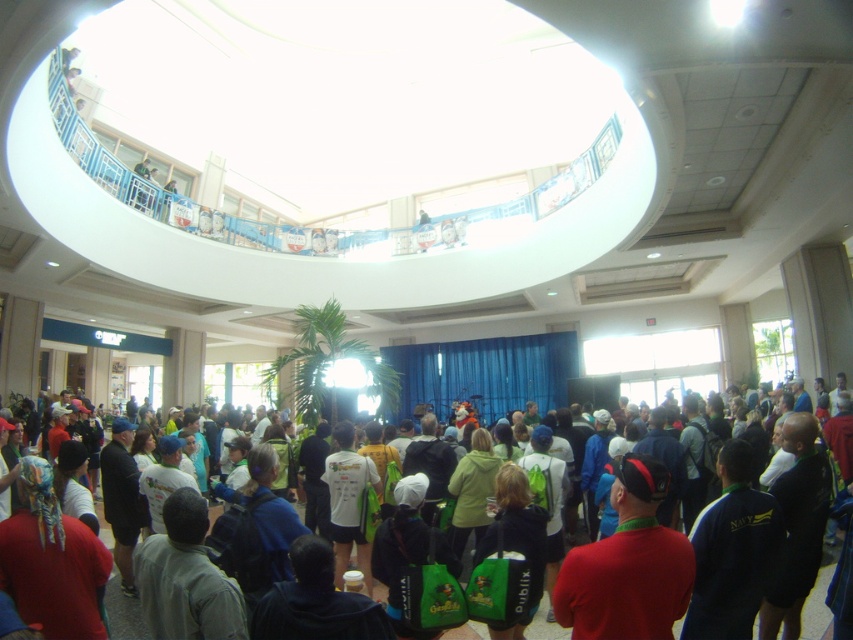
Is red matte shirt at center behind green fabric backpack at center?

That is False.

In the scene shown: Which is below, red matte shirt at center or green fabric backpack at center?

green fabric backpack at center

Is point (680, 614) positioned after point (817, 618)?

No, it is not.

At what (x,y) coordinates should I click in order to perform the action: click on red matte shirt at center. Please return your answer as a coordinate pair (x, y). The height and width of the screenshot is (640, 853). Looking at the image, I should click on point(628,564).